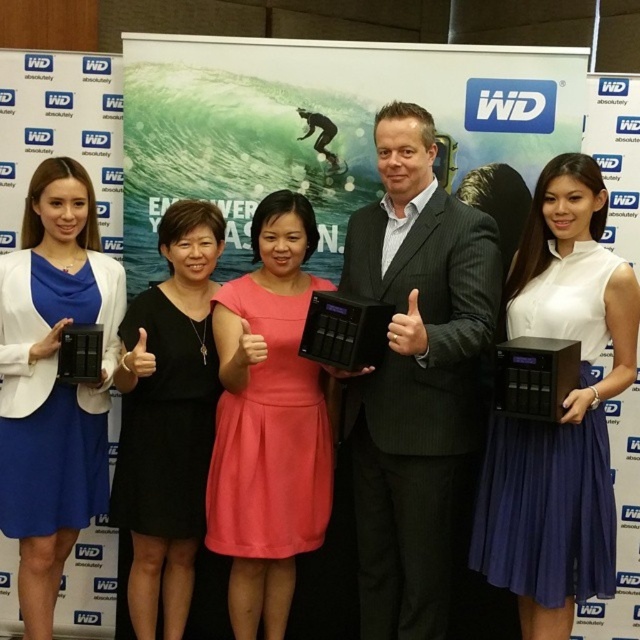
What is the 2D coordinate of the black pinstripe suit at center?

The black pinstripe suit at center is located at the 2D coordinate point of 0.591 in the x axis and 0.650 in the y axis.

Based on the photo, you are at the promotional event and want to take a closer look at the matte black device at left. Which direction should you move relative to the black matte dress at center?

The matte black device at left is to the left of the black matte dress at center, so you should move to the left side of the black matte dress at center to get a closer look.